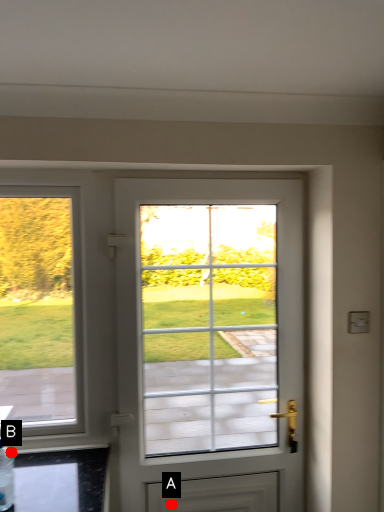
Question: Two points are circled on the image, labeled by A and B beside each circle. Which point appears closest to the camera in this image?

Choices:
 (A) A is closer
 (B) B is closer

Answer: (B)